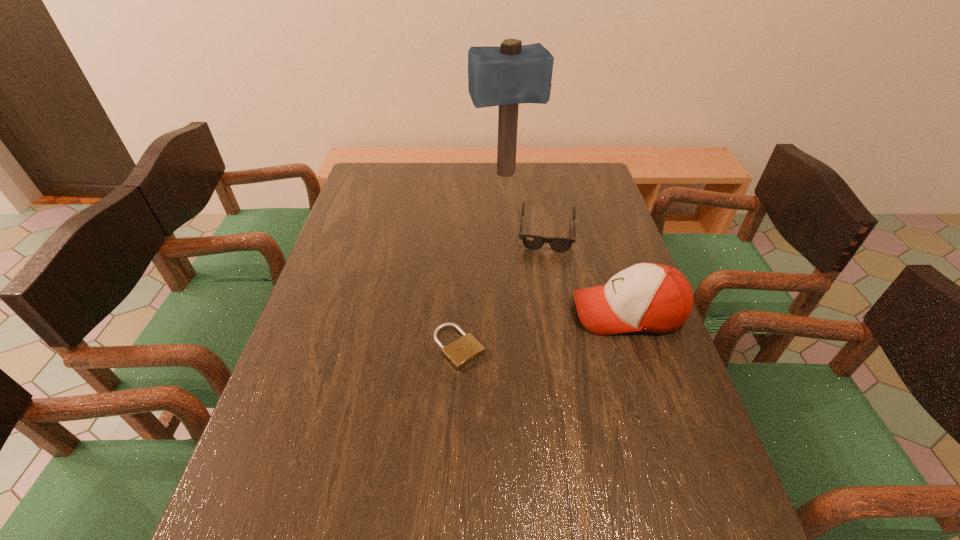
Where is `free space on the desktop that is between the padlock and the third shortest object and is positioned on the striking surface of the tallest object`? The image size is (960, 540). free space on the desktop that is between the padlock and the third shortest object and is positioned on the striking surface of the tallest object is located at coordinates pos(562,326).

Identify the location of free space on the desktop that is between the shortest object and the third shortest object and is positioned on the temples of the second shortest object. The height and width of the screenshot is (540, 960). (540, 330).